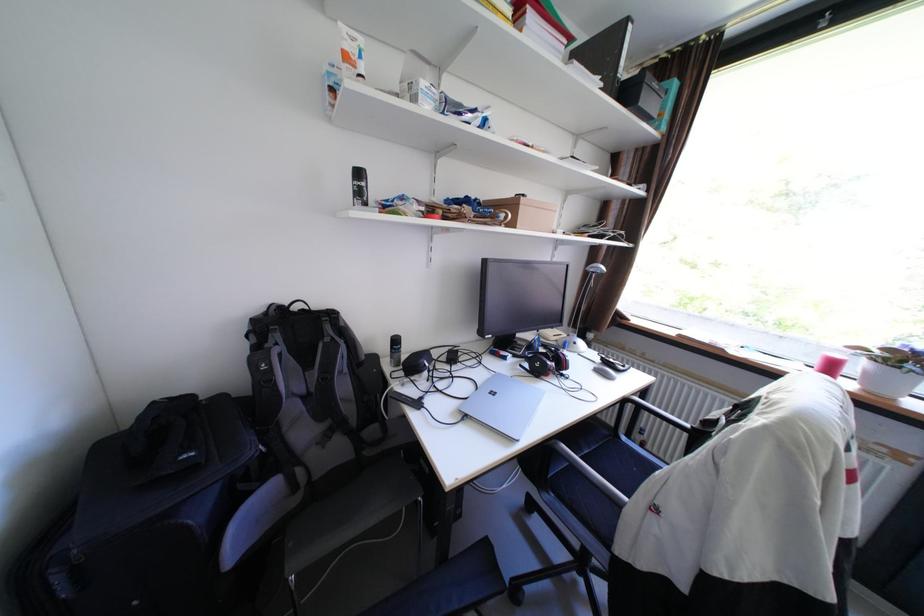
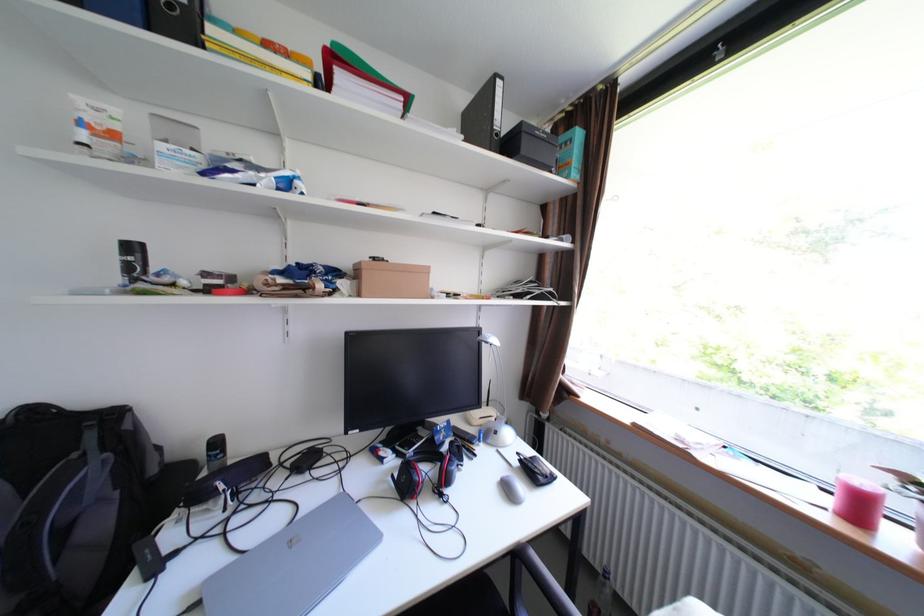
Where in the second image is the point corresponding to pixel 531 366 from the first image?

(403, 477)